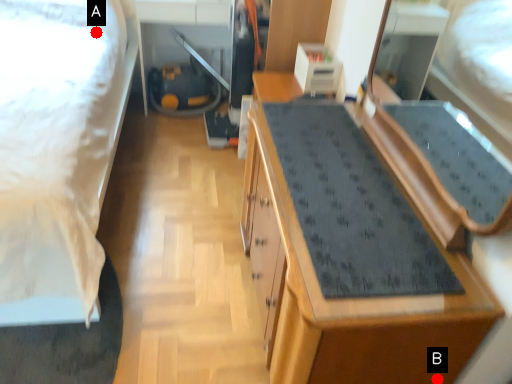
Question: Two points are circled on the image, labeled by A and B beside each circle. Which point is farther from the camera taking this photo?

Choices:
 (A) A is further
 (B) B is further

Answer: (A)